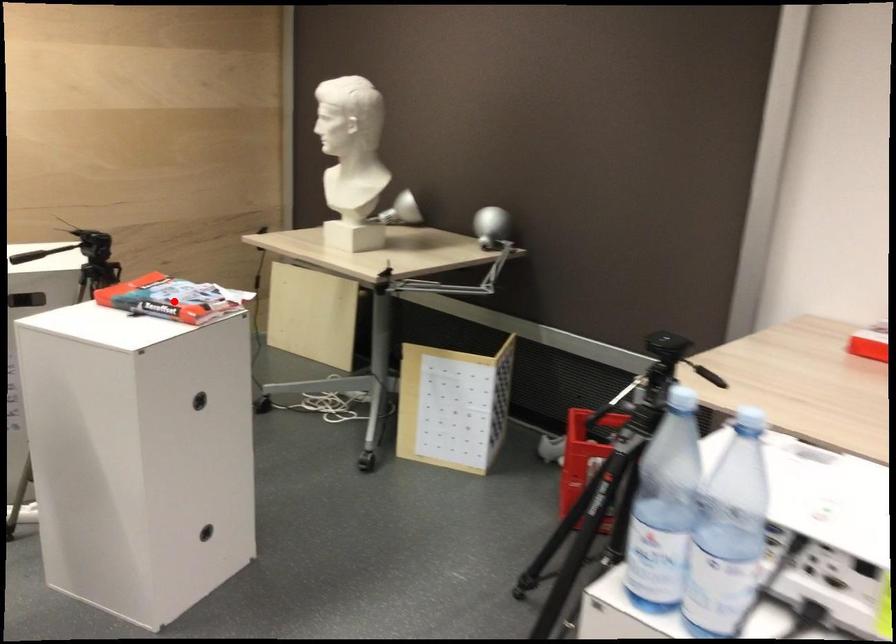
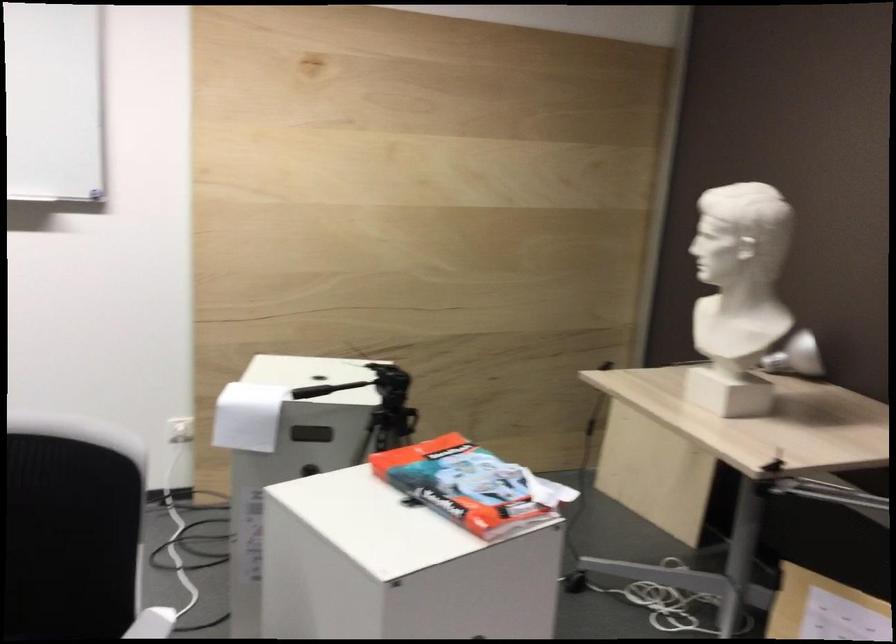
Question: I am providing you with two images of the same scene from different viewpoints. A red point is shown in image1. For the corresponding object point in image2, is it positioned nearer or farther from the camera?

Choices:
 (A) Nearer
 (B) Farther

Answer: (A)